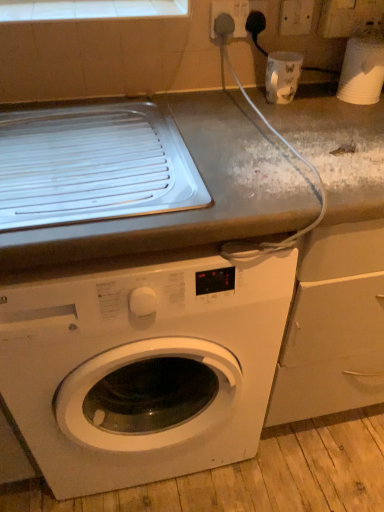
Where is `blank area to the left of white plastic cup at upper right, which appears as the first appliance when viewed from the right`? The image size is (384, 512). blank area to the left of white plastic cup at upper right, which appears as the first appliance when viewed from the right is located at coordinates (313, 104).